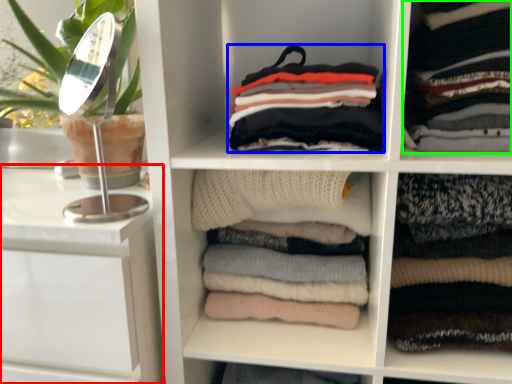
Question: Which object is the closest to the vanity (highlighted by a red box)? Choose among these: clothing (highlighted by a blue box) or clothing (highlighted by a green box).

Choices:
 (A) clothing
 (B) clothing

Answer: (A)